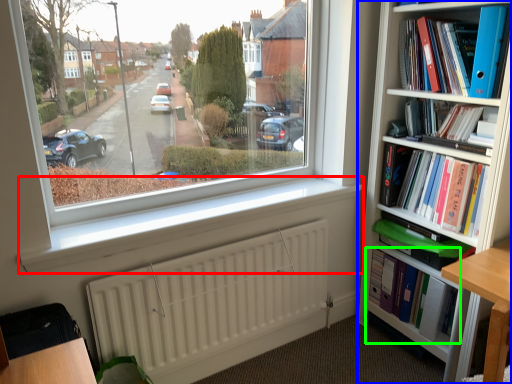
Question: Which object is the farthest from window sill (highlighted by a red box)? Choose among these: bookcase (highlighted by a blue box) or book (highlighted by a green box).

Choices:
 (A) bookcase
 (B) book

Answer: (B)